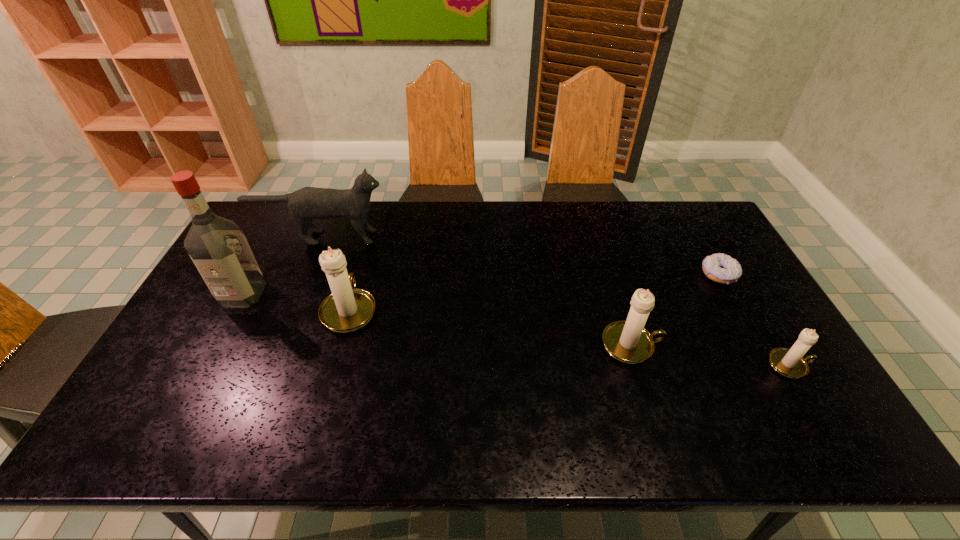
Locate which object is the second closest to the farthest object. Please provide its 2D coordinates. Your answer should be formatted as a tuple, i.e. [(x, y)], where the tuple contains the x and y coordinates of a point satisfying the conditions above.

[(347, 309)]

You are a GUI agent. You are given a task and a screenshot of the screen. Output one action in this format:
    pyautogui.click(x=<x>, y=<y>)
    Task: Click on the object that is the closest to the doughnut
    
    Given the screenshot: What is the action you would take?
    tap(788, 362)

Find the location of a particular element. The width and height of the screenshot is (960, 540). the closest candle holder to the second candle holder from left to right is located at coordinates (788, 362).

Where is `the second closest candle holder to the farthest object`? This screenshot has width=960, height=540. the second closest candle holder to the farthest object is located at coordinates (628, 341).

Identify the location of free spot that satisfies the following two spatial constraints: 1. on the front-facing side of the doughnut; 2. on the left side of the cat. (306, 274).

Find the location of `vacant area in the image that satisfies the following two spatial constraints: 1. on the handle side of the shortest object; 2. on the left side of the leftmost candle holder`. vacant area in the image that satisfies the following two spatial constraints: 1. on the handle side of the shortest object; 2. on the left side of the leftmost candle holder is located at coordinates (360, 274).

Where is `free spot that satisfies the following two spatial constraints: 1. on the front-facing side of the farthest object; 2. on the handle side of the leftmost candle holder`? This screenshot has height=540, width=960. free spot that satisfies the following two spatial constraints: 1. on the front-facing side of the farthest object; 2. on the handle side of the leftmost candle holder is located at coordinates (292, 309).

You are a GUI agent. You are given a task and a screenshot of the screen. Output one action in this format:
    pyautogui.click(x=<x>, y=<y>)
    Task: Click on the vacant position in the image that satisfies the following two spatial constraints: 1. on the front-facing side of the shortest object; 2. on the right side of the farthest object
    The image size is (960, 540).
    Given the screenshot: What is the action you would take?
    click(306, 274)

Locate an element on the screen. The width and height of the screenshot is (960, 540). vacant space that satisfies the following two spatial constraints: 1. on the front-facing side of the doughnut; 2. on the left side of the cat is located at coordinates (306, 274).